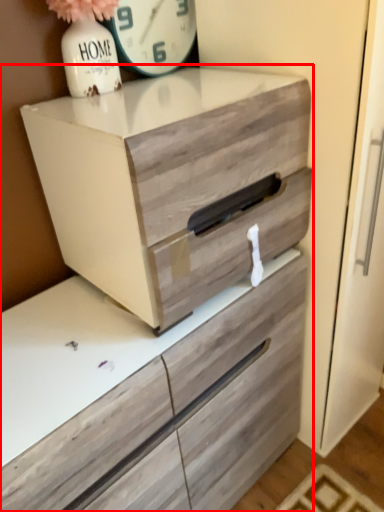
Question: Considering the relative positions of chest of drawers (annotated by the red box) and clock in the image provided, where is chest of drawers (annotated by the red box) located with respect to the staircase?

Choices:
 (A) right
 (B) left

Answer: (A)